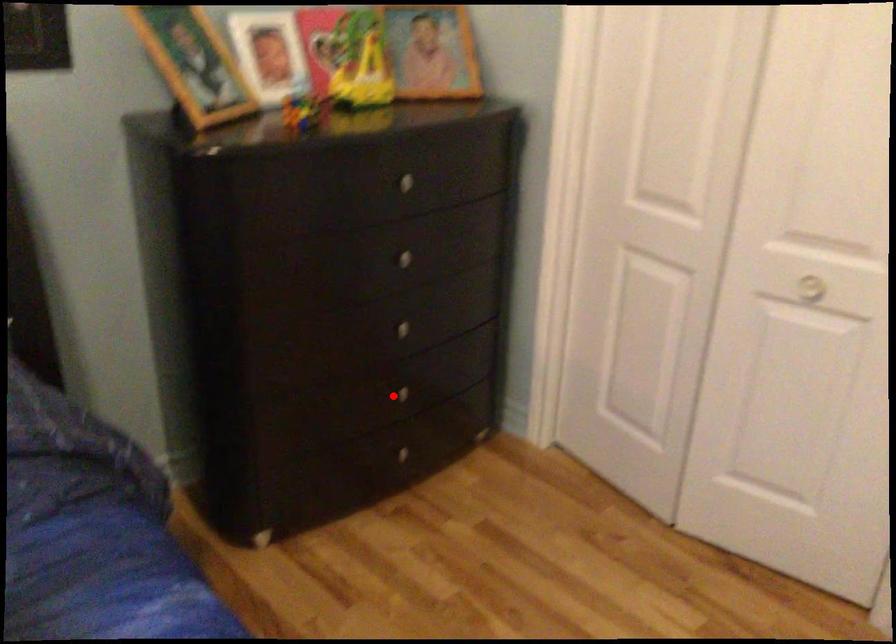
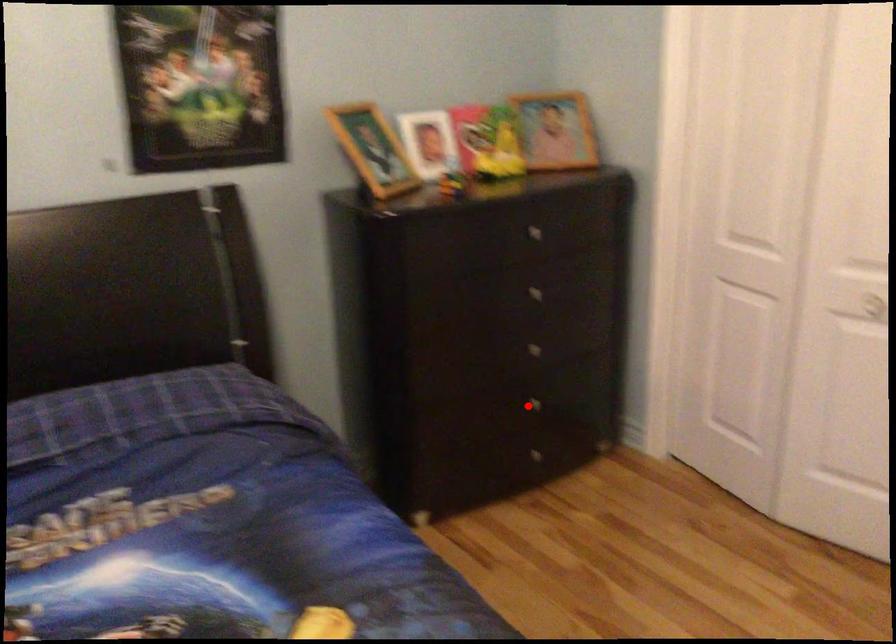
I am providing you with two images of the same scene from different viewpoints. A red point is marked on the first image and another point is marked on the second image. Do the highlighted points in image1 and image2 indicate the same real-world spot?

Yes